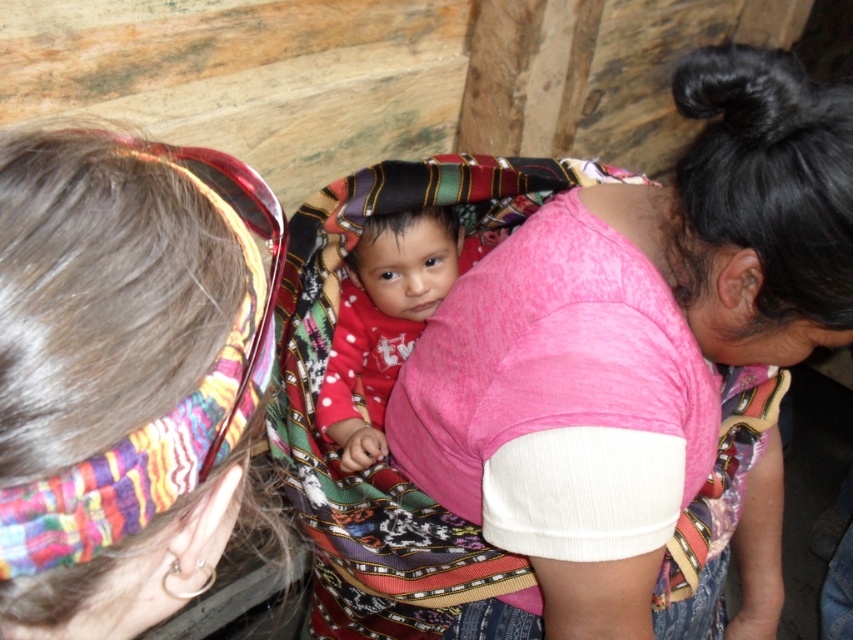
You are a tailor who needs to determine which fabric is more suitable for making a large dress. Given that the pink fabric at center and the red polka dot fabric at center are available, which one would you choose based on their sizes?

The pink fabric at center has a larger size compared to the red polka dot fabric at center, so it is more suitable for making a large dress.

You are an interior designer assessing the placement of fabrics in a room. You see the multicolored woven cloth at upper center and the red polka dot fabric at center. Which fabric is positioned closer to you?

The multicolored woven cloth at upper center is closer to the viewer than the red polka dot fabric at center.

You are an interior designer planning to place a new shelf between the pink fabric at center and the multicolored woven cloth at upper center. Based on their positions, which object should the shelf be placed in front of to maintain visibility of both?

The shelf should be placed in front of the multicolored woven cloth at upper center because it is behind the pink fabric at center, so placing the shelf in front of it will keep both objects visible.